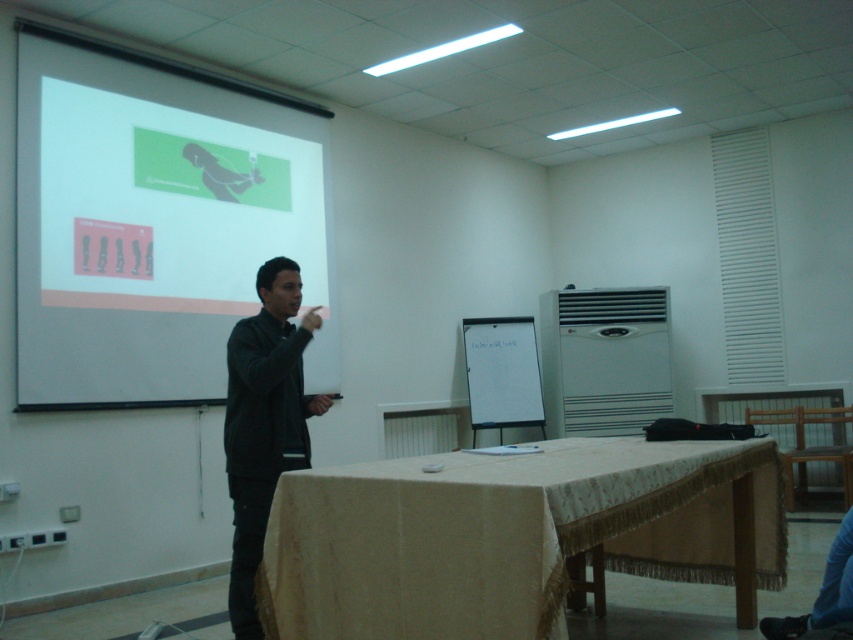
Who is positioned more to the right, white matte projection screen at upper left or black matte jacket at center?

From the viewer's perspective, black matte jacket at center appears more on the right side.

Does point (154, 200) lie behind point (234, 470)?

Yes, it is behind point (234, 470).

Does point (129, 193) come closer to viewer compared to point (289, 285)?

No, (129, 193) is further to viewer.

Find the location of a particular element. The image size is (853, 640). white matte projection screen at upper left is located at coordinates (149, 224).

At what (x,y) coordinates should I click in order to perform the action: click on white matte projection screen at upper left. Please return your answer as a coordinate pair (x, y). The image size is (853, 640). Looking at the image, I should click on (149, 224).

Between white matte projection screen at upper left and white matte flipchart at center, which one has less height?

Standing shorter between the two is white matte flipchart at center.

Is point (97, 392) positioned in front of point (538, 378)?

That is True.

Identify the location of white matte projection screen at upper left. (149, 224).

Does white matte projection screen at upper left appear under beige fabric-covered table at center?

Actually, white matte projection screen at upper left is above beige fabric-covered table at center.

Looking at this image, can you confirm if white matte projection screen at upper left is positioned above beige fabric-covered table at center?

Indeed, white matte projection screen at upper left is positioned over beige fabric-covered table at center.

Which is in front, point (253, 161) or point (514, 572)?

Positioned in front is point (514, 572).

Locate an element on the screen. white matte projection screen at upper left is located at coordinates (149, 224).